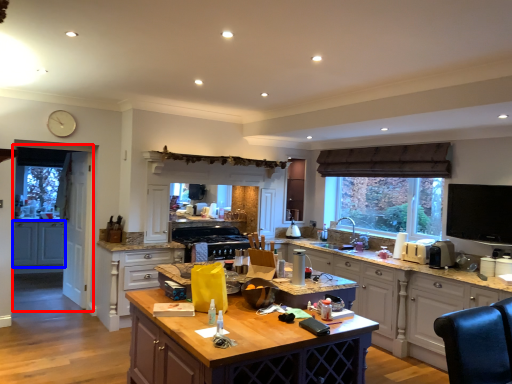
Question: Which of the following is the closest to the observer, screen door (highlighted by a red box) or cabinetry (highlighted by a blue box)?

Choices:
 (A) screen door
 (B) cabinetry

Answer: (A)